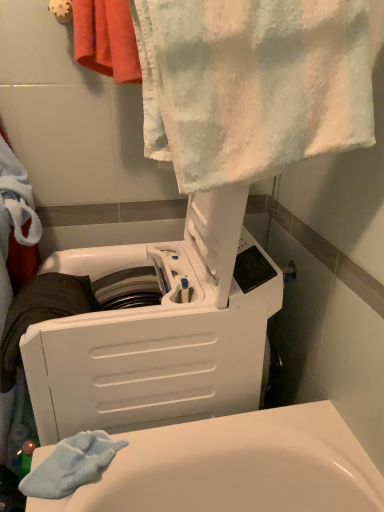
The image size is (384, 512). In order to click on red cotton towel at upper left, marked as the 1th towel in a back-to-front arrangement in this screenshot , I will do `click(106, 39)`.

Who is bigger, white textured towel at upper center, which ranks as the 1th towel in front-to-back order, or red cotton towel at upper left, which is the 2th towel from front to back?

white textured towel at upper center, which ranks as the 1th towel in front-to-back order.

From the image's perspective, is white textured towel at upper center, which is the second towel from back to front, over red cotton towel at upper left, which is the 2th towel from front to back?

No, from the image's perspective, white textured towel at upper center, which is the second towel from back to front, is not on top of red cotton towel at upper left, which is the 2th towel from front to back.

Between point (380, 9) and point (109, 69), which one is positioned in front?

The point (380, 9) is closer.

What are the coordinates of `towel above the white textured towel at upper center, which ranks as the 1th towel in front-to-back order (from a real-world perspective)` in the screenshot? It's located at (106, 39).

Is point (218, 350) positioned after point (327, 68)?

Yes, point (218, 350) is behind point (327, 68).

Considering the sizes of objects white plastic washing machine at upper center and white textured towel at upper center, which ranks as the 1th towel in front-to-back order, in the image provided, who is smaller, white plastic washing machine at upper center or white textured towel at upper center, which ranks as the 1th towel in front-to-back order,?

white textured towel at upper center, which ranks as the 1th towel in front-to-back order.

Is white plastic washing machine at upper center inside or outside of white textured towel at upper center, which is the second towel from back to front?

white plastic washing machine at upper center is spatially situated outside white textured towel at upper center, which is the second towel from back to front.

Is white plastic washing machine at upper center oriented away from white textured towel at upper center, which is the second towel from back to front?

That's not correct — white plastic washing machine at upper center is not looking away from white textured towel at upper center, which is the second towel from back to front.

Can you confirm if white textured towel at upper center, which is the second towel from back to front, is bigger than white plastic washing machine at upper center?

Incorrect, white textured towel at upper center, which is the second towel from back to front, is not larger than white plastic washing machine at upper center.

Considering the points (195, 108) and (86, 353), which point is in front, point (195, 108) or point (86, 353)?

The point (195, 108) is closer to the camera.

Who is more distant, white textured towel at upper center, which is the second towel from back to front, or white plastic washing machine at upper center?

white plastic washing machine at upper center.

Which object is positioned more to the right, white plastic washing machine at upper center or red cotton towel at upper left, marked as the 1th towel in a back-to-front arrangement?

From the viewer's perspective, red cotton towel at upper left, marked as the 1th towel in a back-to-front arrangement, appears more on the right side.

Does white plastic washing machine at upper center have a lesser width compared to red cotton towel at upper left, which is the 2th towel from front to back?

Incorrect, the width of white plastic washing machine at upper center is not less than that of red cotton towel at upper left, which is the 2th towel from front to back.

Based on the photo, is the depth of white plastic washing machine at upper center greater than that of red cotton towel at upper left, marked as the 1th towel in a back-to-front arrangement?

No, white plastic washing machine at upper center is closer to the camera.

Looking at the image, does red cotton towel at upper left, which is the 2th towel from front to back, seem bigger or smaller compared to white plastic washing machine at upper center?

In the image, red cotton towel at upper left, which is the 2th towel from front to back, appears to be smaller than white plastic washing machine at upper center.

From the image's perspective, is red cotton towel at upper left, marked as the 1th towel in a back-to-front arrangement, above white plastic washing machine at upper center?

Yes, from the image's perspective, red cotton towel at upper left, marked as the 1th towel in a back-to-front arrangement, is on top of white plastic washing machine at upper center.

Is red cotton towel at upper left, which is the 2th towel from front to back, far from white plastic washing machine at upper center?

red cotton towel at upper left, which is the 2th towel from front to back, is near white plastic washing machine at upper center, not far away.

Considering the relative positions of red cotton towel at upper left, marked as the 1th towel in a back-to-front arrangement, and white plastic washing machine at upper center in the image provided, is red cotton towel at upper left, marked as the 1th towel in a back-to-front arrangement, to the left of white plastic washing machine at upper center from the viewer's perspective?

In fact, red cotton towel at upper left, marked as the 1th towel in a back-to-front arrangement, is to the right of white plastic washing machine at upper center.

In the scene shown: From the image's perspective, would you say red cotton towel at upper left, which is the 2th towel from front to back, is positioned over white textured towel at upper center, which is the second towel from back to front?

Yes, from the image's perspective, red cotton towel at upper left, which is the 2th towel from front to back, is over white textured towel at upper center, which is the second towel from back to front.

Can you confirm if red cotton towel at upper left, marked as the 1th towel in a back-to-front arrangement, is wider than white textured towel at upper center, which is the second towel from back to front?

In fact, red cotton towel at upper left, marked as the 1th towel in a back-to-front arrangement, might be narrower than white textured towel at upper center, which is the second towel from back to front.

Considering the sizes of objects red cotton towel at upper left, which is the 2th towel from front to back, and white textured towel at upper center, which is the second towel from back to front, in the image provided, who is taller, red cotton towel at upper left, which is the 2th towel from front to back, or white textured towel at upper center, which is the second towel from back to front,?

Standing taller between the two is white textured towel at upper center, which is the second towel from back to front.

Which is behind, point (123, 61) or point (237, 70)?

The point (123, 61) is farther.

Locate an element on the screen. towel that appears on the left of white textured towel at upper center, which is the second towel from back to front is located at coordinates (106, 39).

Locate an element on the screen. appliance lying behind the white textured towel at upper center, which is the second towel from back to front is located at coordinates (158, 330).

Looking at the image, which one is located closer to white plastic washing machine at upper center, white textured towel at upper center, which is the second towel from back to front, or red cotton towel at upper left, which is the 2th towel from front to back?

white textured towel at upper center, which is the second towel from back to front, is closer to white plastic washing machine at upper center.

From the image, which object appears to be nearer to red cotton towel at upper left, which is the 2th towel from front to back, white plastic washing machine at upper center or white textured towel at upper center, which is the second towel from back to front?

white textured towel at upper center, which is the second towel from back to front.

Which object lies nearer to the anchor point white plastic washing machine at upper center, red cotton towel at upper left, which is the 2th towel from front to back, or white textured towel at upper center, which is the second towel from back to front?

white textured towel at upper center, which is the second towel from back to front.

Looking at the image, which one is located closer to red cotton towel at upper left, marked as the 1th towel in a back-to-front arrangement, white textured towel at upper center, which is the second towel from back to front, or white plastic washing machine at upper center?

The object closer to red cotton towel at upper left, marked as the 1th towel in a back-to-front arrangement, is white textured towel at upper center, which is the second towel from back to front.

Which object lies further to the anchor point white textured towel at upper center, which is the second towel from back to front, white plastic washing machine at upper center or red cotton towel at upper left, which is the 2th towel from front to back?

The object further to white textured towel at upper center, which is the second towel from back to front, is red cotton towel at upper left, which is the 2th towel from front to back.

Based on their spatial positions, is red cotton towel at upper left, marked as the 1th towel in a back-to-front arrangement, or white plastic washing machine at upper center further from white textured towel at upper center, which is the second towel from back to front?

red cotton towel at upper left, marked as the 1th towel in a back-to-front arrangement, lies further to white textured towel at upper center, which is the second towel from back to front, than the other object.

Locate an element on the screen. This screenshot has height=512, width=384. towel between red cotton towel at upper left, marked as the 1th towel in a back-to-front arrangement, and white plastic washing machine at upper center from top to bottom is located at coordinates (252, 84).